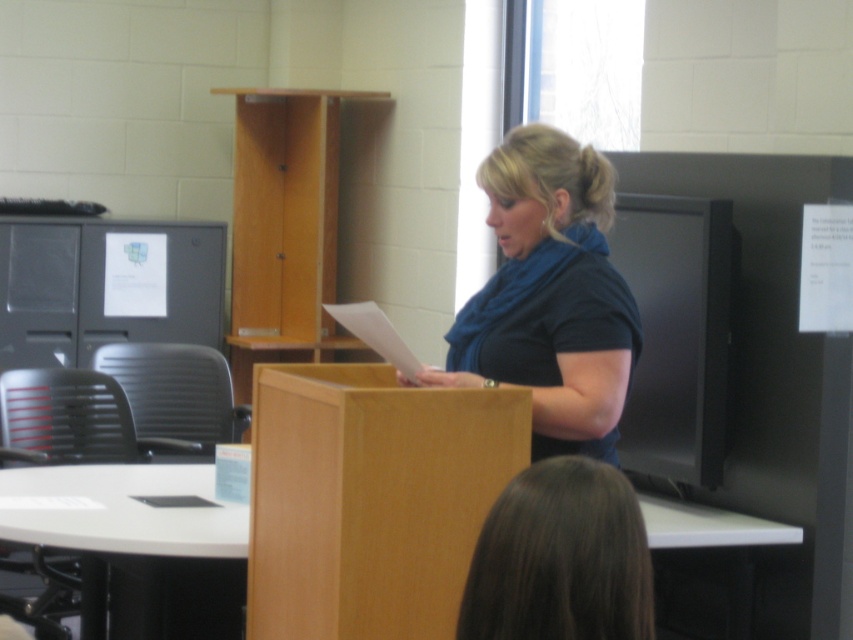
A photographer wants to capture a closeup of the blue matte scarf at center. The camera is currently positioned at point 0.5, 0.5. Should the photographer move the camera to the left or right to frame the scarf properly?

The blue matte scarf at center is located at point [550,296]. Since the camera is at [426,320], the photographer should move the camera slightly to the left and up to align with the scarf.